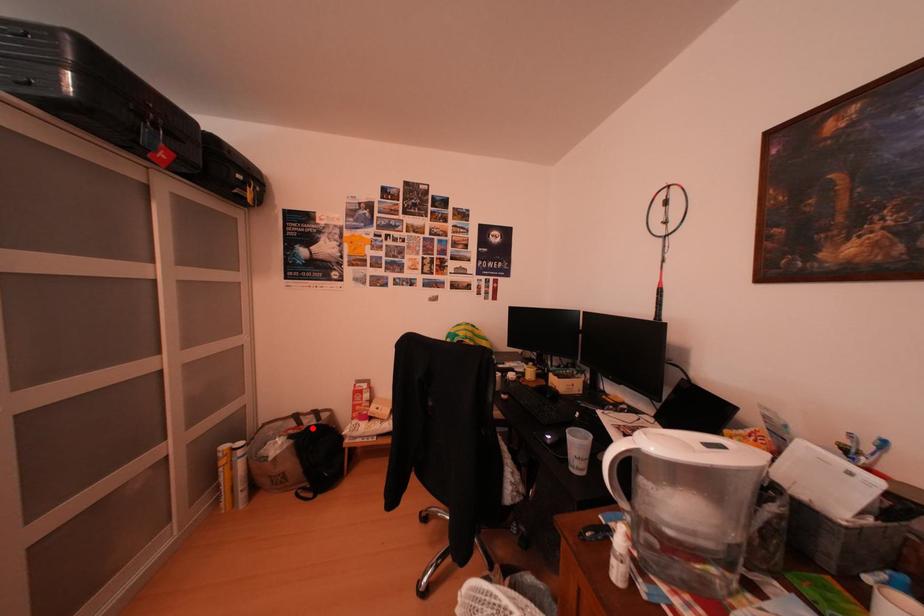
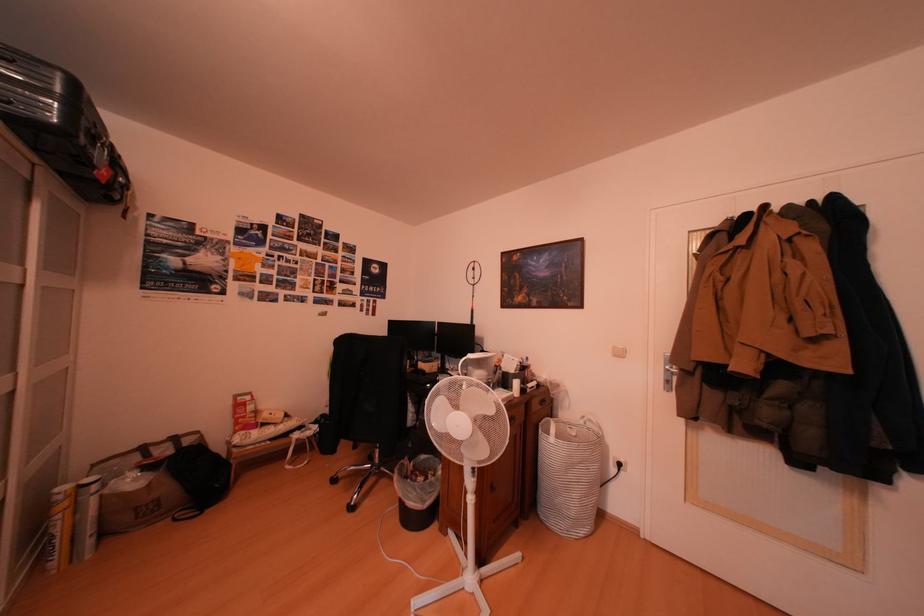
In the second image, find the point that corresponds to the highlighted location in the first image.

(161, 461)